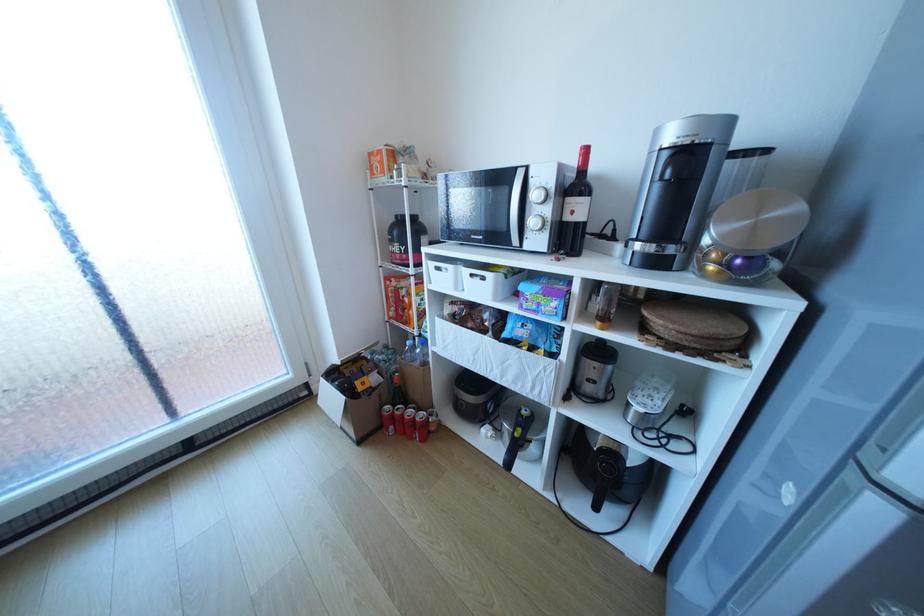
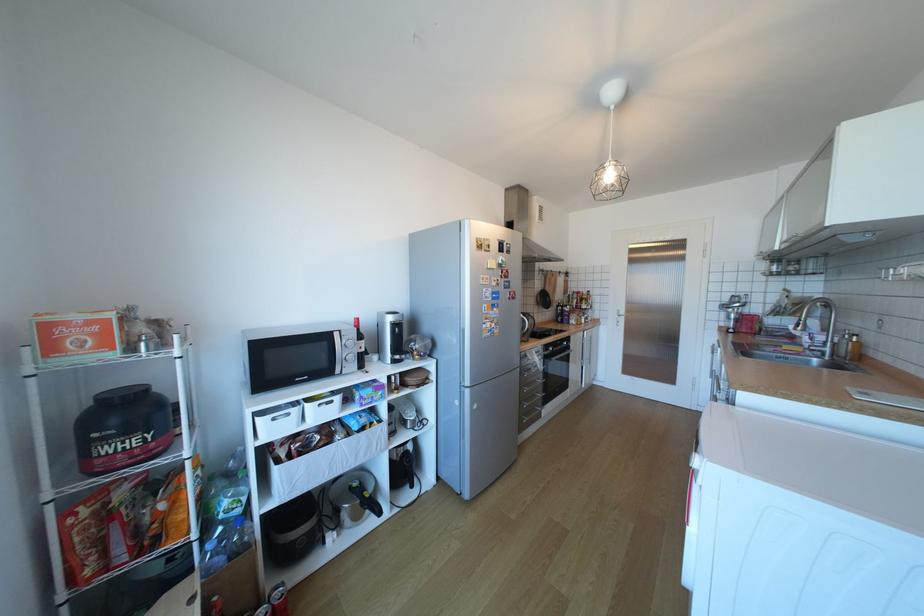
Locate, in the second image, the point that corresponds to (423,416) in the first image.

(283, 607)